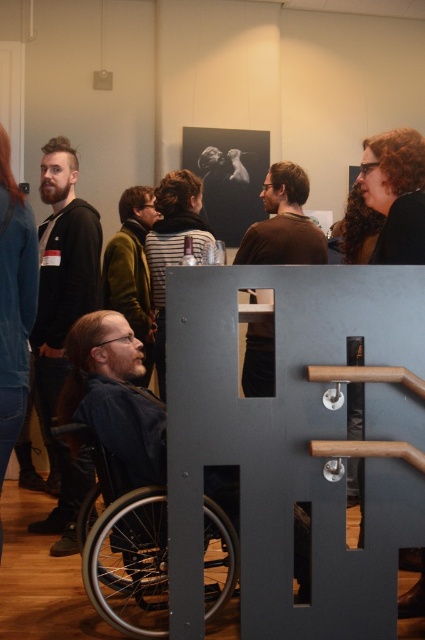
Looking at this image, you are at an event and see two people wearing dark brown hoodie at left and brown matte shirt at center. Which one is more to the left?

The dark brown hoodie at left is more to the left.

You are standing in the event space and want to move from the metal barrier with cutouts to the black and white portrait on the wall. Which direction should you move relative to the two points, point (206,602) and point (99,412)?

You should move towards point (99,412) because it is closer to the black and white portrait on the wall than point (206,602), which is further away from it.

You are a photographer at this event and want to capture both the dark brown hoodie at left and the brown matte shirt at center in the same frame. The camera you are using has a maximum focus range of 30 inches. Can you include both subjects in the shot without moving the camera?

The distance between the dark brown hoodie at left and the brown matte shirt at center is 33.41 inches, which exceeds the camera maximum focus range of 30 inches. Therefore, you cannot include both subjects in the shot without moving the camera.